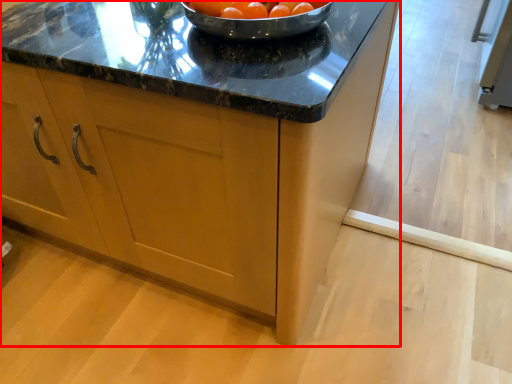
Question: Observing the image, what is the correct spatial positioning of cabinetry (annotated by the red box) in reference to tomato?

Choices:
 (A) right
 (B) left

Answer: (B)